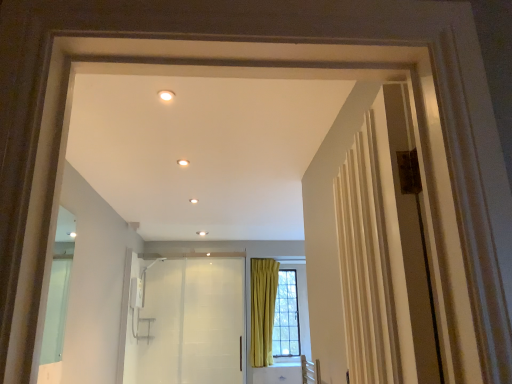
Question: Is point (168, 271) closer or farther from the camera than point (283, 299)?

Choices:
 (A) farther
 (B) closer

Answer: (B)

Question: From a real-world perspective, is white glossy elevator at center above or below clear glass window at center?

Choices:
 (A) below
 (B) above

Answer: (A)

Question: Visually, is white glossy elevator at center positioned to the left or to the right of clear glass window at center?

Choices:
 (A) left
 (B) right

Answer: (A)

Question: In terms of height, does clear glass window at center look taller or shorter compared to white glossy elevator at center?

Choices:
 (A) short
 (B) tall

Answer: (A)

Question: From a real-world perspective, is clear glass window at center physically located above or below white glossy elevator at center?

Choices:
 (A) above
 (B) below

Answer: (A)

Question: Is clear glass window at center in front of or behind white glossy elevator at center in the image?

Choices:
 (A) behind
 (B) front

Answer: (A)

Question: From the image's perspective, is clear glass window at center above or below white glossy elevator at center?

Choices:
 (A) below
 (B) above

Answer: (A)